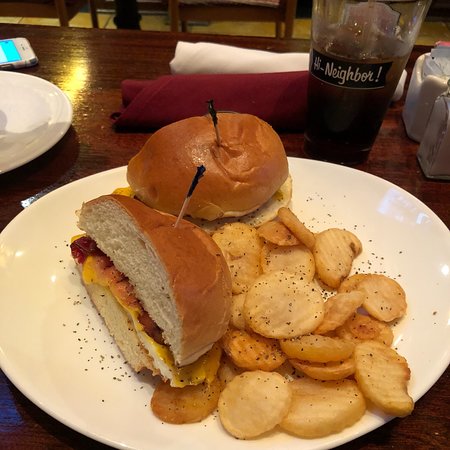
Find the location of a particular element. chair cushion is located at coordinates (266, 3).